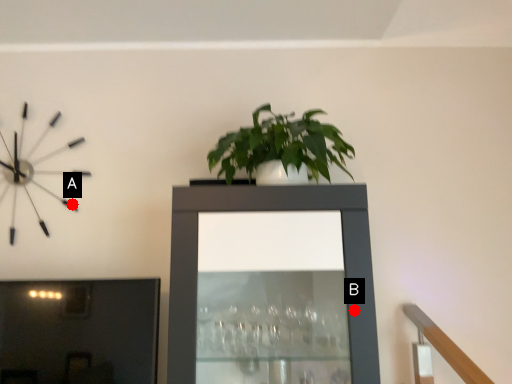
Question: Two points are circled on the image, labeled by A and B beside each circle. Among these points, which one is farthest from the camera?

Choices:
 (A) A is further
 (B) B is further

Answer: (A)